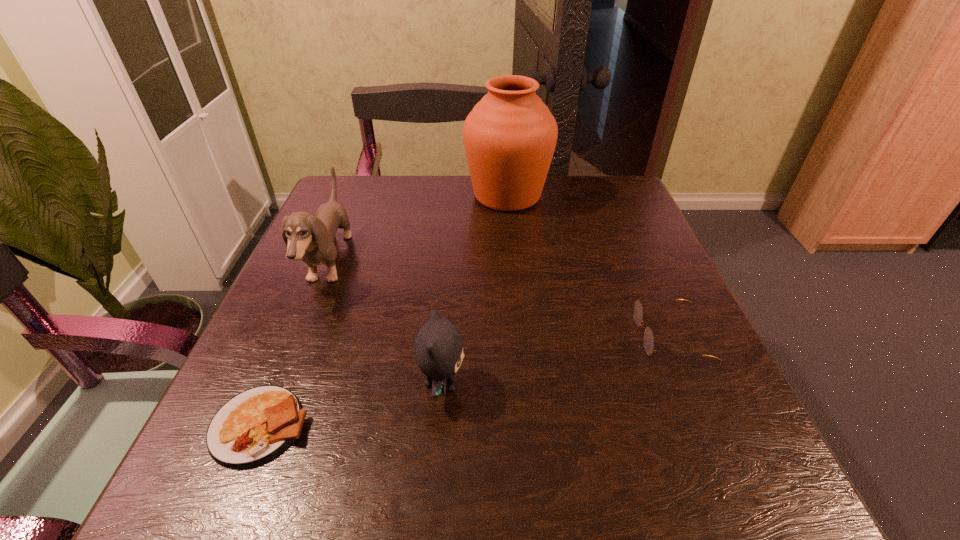
Where is `the farthest object`? The height and width of the screenshot is (540, 960). the farthest object is located at coordinates (510, 135).

Identify the location of the tallest object. This screenshot has height=540, width=960. (510, 135).

Locate an element on the screen. The image size is (960, 540). puppy is located at coordinates (311, 238).

Where is `kitten`? kitten is located at coordinates (438, 348).

At what (x,y) coordinates should I click in order to perform the action: click on the second shortest object. Please return your answer as a coordinate pair (x, y). The image size is (960, 540). Looking at the image, I should click on [648, 338].

Find the location of a particular element. spectacles is located at coordinates click(648, 338).

I want to click on omelet, so click(256, 425).

Find the location of a particular element. This screenshot has width=960, height=540. vacant space located 0.310m on the left of the farthest object is located at coordinates (343, 195).

Find the location of a particular element. Image resolution: width=960 pixels, height=540 pixels. vacant space situated 0.160m at the face of the puppy is located at coordinates (424, 262).

Where is `free space located on the front-facing side of the kitten`? This screenshot has height=540, width=960. free space located on the front-facing side of the kitten is located at coordinates (656, 384).